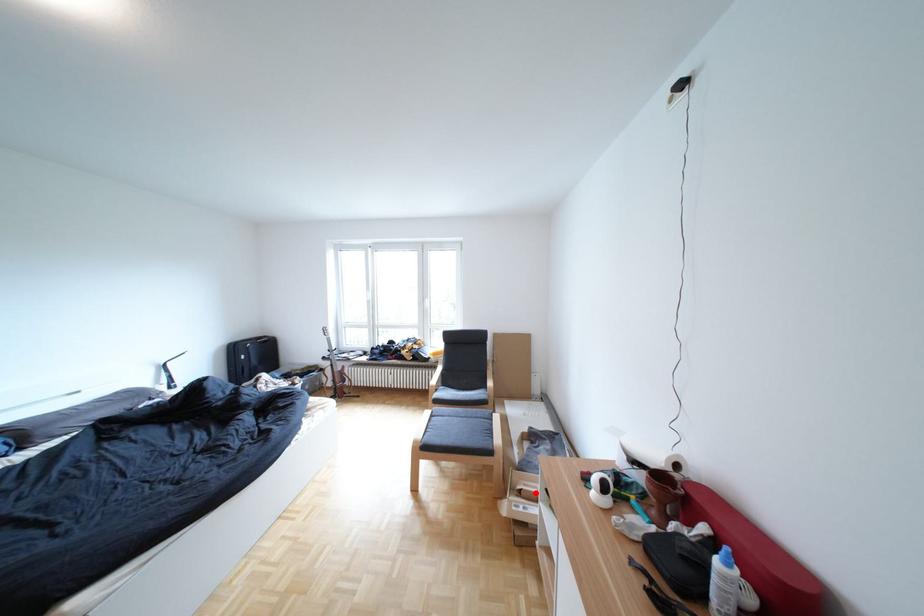
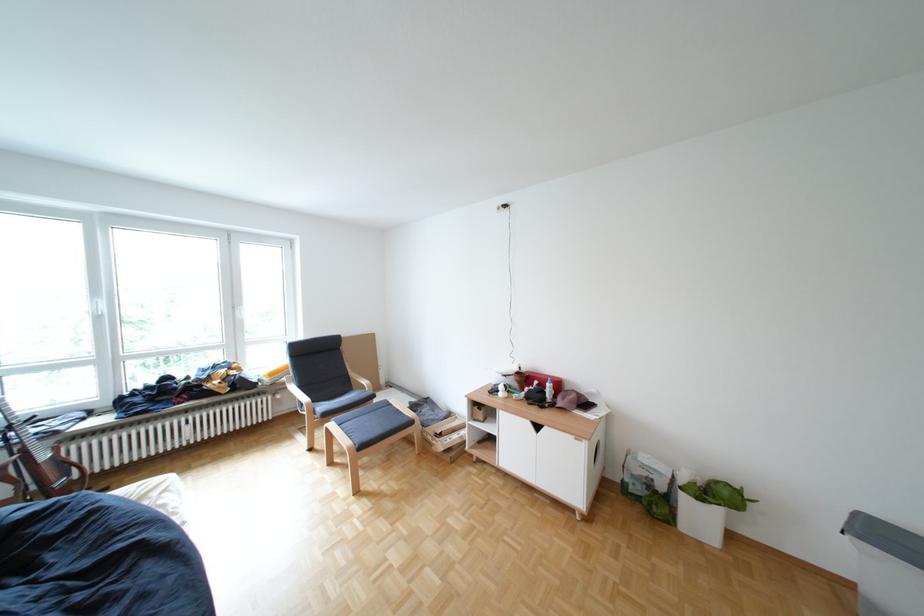
Question: I am providing you with two images of the same scene from different viewpoints. Image1 has a red point marked. In image2, the corresponding 3D location appears at what relative position? Reply with the corresponding letter.

Choices:
 (A) Closer
 (B) Farther

Answer: (A)